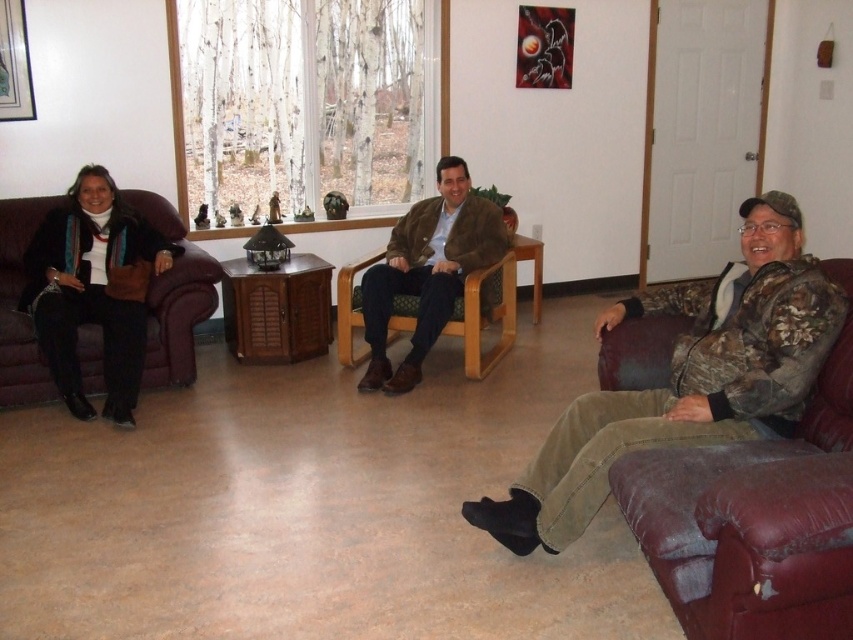
You are organizing a small event in this living room and need to place a decorative item on a table. The table can only hold items smaller than the brown suede jacket at center. Can the brushed metal picture frame at upper left fit on the table?

The brown suede jacket at center is larger in size than the brushed metal picture frame at upper left, so the brushed metal picture frame at upper left is smaller and can fit on the table.